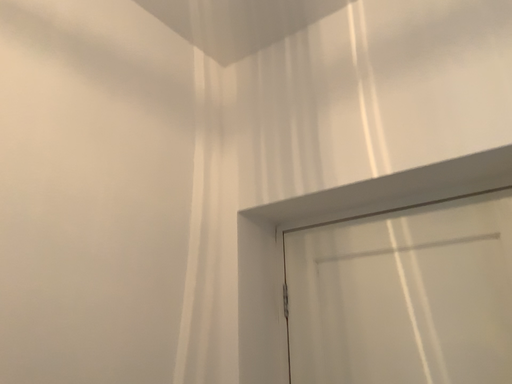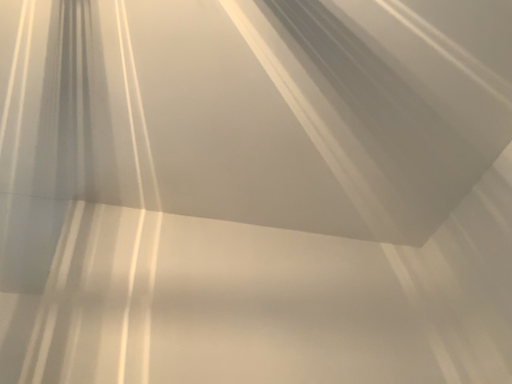
Question: How did the camera likely rotate when shooting the video?

Choices:
 (A) rotated downward
 (B) rotated upward

Answer: (B)